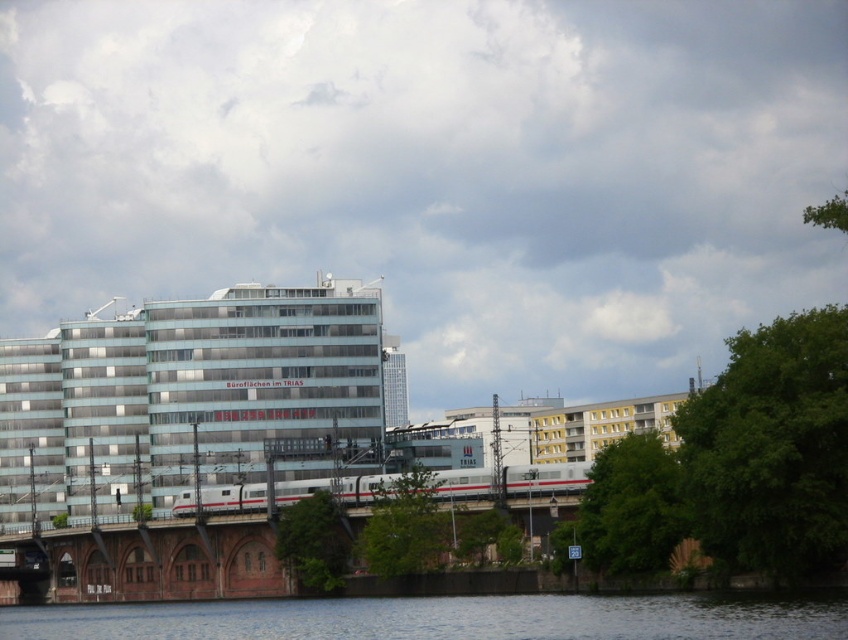
Who is higher up, light blue glass building at center or silver metallic train at center?

light blue glass building at center is higher up.

Which of these two, light blue glass building at center or silver metallic train at center, stands shorter?

silver metallic train at center

Does point (166, 321) come closer to viewer compared to point (395, 474)?

No.

Where is `light blue glass building at center`? The image size is (848, 640). light blue glass building at center is located at coordinates (190, 397).

Does transparent water at lower center come behind silver metallic train at center?

No.

Which is behind, point (773, 604) or point (458, 493)?

The point (458, 493) is more distant.

You are a GUI agent. You are given a task and a screenshot of the screen. Output one action in this format:
    pyautogui.click(x=<x>, y=<y>)
    Task: Click on the transparent water at lower center
    Image resolution: width=848 pixels, height=640 pixels.
    Given the screenshot: What is the action you would take?
    pyautogui.click(x=445, y=618)

Who is lower down, light blue glass building at center or transparent water at lower center?

transparent water at lower center is lower down.

Is the position of light blue glass building at center more distant than that of transparent water at lower center?

Yes, light blue glass building at center is further from the viewer.

I want to click on light blue glass building at center, so click(x=190, y=397).